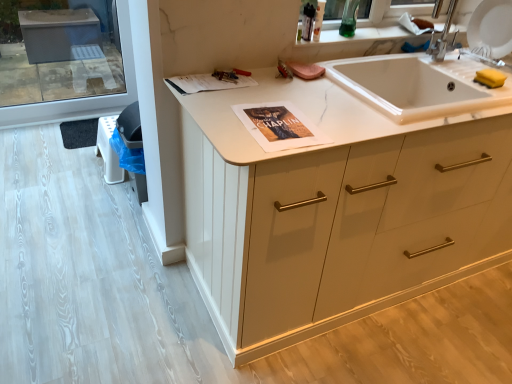
Question: Is white matte cabinet at center in front of matte paper magazine at upper center?

Choices:
 (A) yes
 (B) no

Answer: (A)

Question: Does white matte cabinet at center have a lesser width compared to matte paper magazine at upper center?

Choices:
 (A) yes
 (B) no

Answer: (B)

Question: Considering the relative sizes of white matte cabinet at center and matte paper magazine at upper center in the image provided, is white matte cabinet at center taller than matte paper magazine at upper center?

Choices:
 (A) yes
 (B) no

Answer: (A)

Question: From the image's perspective, is white matte cabinet at center under matte paper magazine at upper center?

Choices:
 (A) yes
 (B) no

Answer: (A)

Question: Considering the relative positions of white matte cabinet at center and matte paper magazine at upper center in the image provided, is white matte cabinet at center to the right of matte paper magazine at upper center from the viewer's perspective?

Choices:
 (A) yes
 (B) no

Answer: (A)

Question: Visually, is white marble sink at center positioned to the left or to the right of matte paper magazine at upper center?

Choices:
 (A) right
 (B) left

Answer: (A)

Question: In terms of width, does white marble sink at center look wider or thinner when compared to matte paper magazine at upper center?

Choices:
 (A) thin
 (B) wide

Answer: (B)

Question: From the image's perspective, is white marble sink at center located above or below matte paper magazine at upper center?

Choices:
 (A) below
 (B) above

Answer: (A)

Question: In the image, is white marble sink at center positioned in front of or behind matte paper magazine at upper center?

Choices:
 (A) behind
 (B) front

Answer: (B)

Question: From the image's perspective, is matte paper magazine at upper center positioned above or below white matte cabinet at center?

Choices:
 (A) above
 (B) below

Answer: (A)

Question: From their relative heights in the image, would you say matte paper magazine at upper center is taller or shorter than white matte cabinet at center?

Choices:
 (A) tall
 (B) short

Answer: (B)

Question: Would you say matte paper magazine at upper center is to the left or to the right of white matte cabinet at center in the picture?

Choices:
 (A) right
 (B) left

Answer: (B)

Question: Does point (201, 74) appear closer or farther from the camera than point (487, 173)?

Choices:
 (A) farther
 (B) closer

Answer: (B)

Question: In terms of width, does matte paper magazine at upper center look wider or thinner when compared to white marble sink at center?

Choices:
 (A) thin
 (B) wide

Answer: (A)

Question: In the image, is matte paper magazine at upper center on the left side or the right side of white marble sink at center?

Choices:
 (A) left
 (B) right

Answer: (A)